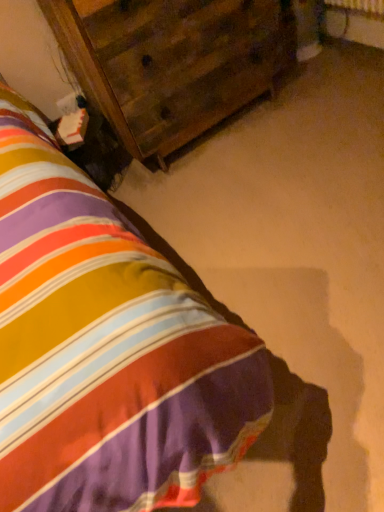
What do you see at coordinates (106, 348) in the screenshot?
I see `wooden nightstand at center` at bounding box center [106, 348].

Locate an element on the screen. wooden nightstand at center is located at coordinates (106, 348).

What is the approximate width of wooden nightstand at center?

wooden nightstand at center is 6.70 feet wide.

What do you see at coordinates (172, 62) in the screenshot? This screenshot has width=384, height=512. I see `wooden dresser at upper left` at bounding box center [172, 62].

Locate an element on the screen. This screenshot has height=512, width=384. wooden dresser at upper left is located at coordinates pos(172,62).

Where is `wooden nightstand at center`? The image size is (384, 512). wooden nightstand at center is located at coordinates (106, 348).

Looking at this image, is wooden nightstand at center to the left of wooden dresser at upper left from the viewer's perspective?

Incorrect, wooden nightstand at center is not on the left side of wooden dresser at upper left.

Looking at this image, does wooden nightstand at center lie in front of wooden dresser at upper left?

Yes, wooden nightstand at center is closer to the camera.

Considering the points (118, 482) and (73, 9), which point is behind, point (118, 482) or point (73, 9)?

The point (73, 9) is farther from the camera.

From the image's perspective, who appears lower, wooden nightstand at center or wooden dresser at upper left?

From the image's view, wooden nightstand at center is below.

From a real-world perspective, which is physically below, wooden nightstand at center or wooden dresser at upper left?

From a 3D spatial view, wooden nightstand at center is below.

Which object is wider, wooden nightstand at center or wooden dresser at upper left?

wooden nightstand at center is wider.

Which of these two, wooden nightstand at center or wooden dresser at upper left, stands shorter?

wooden nightstand at center.

Considering the relative sizes of wooden nightstand at center and wooden dresser at upper left in the image provided, is wooden nightstand at center smaller than wooden dresser at upper left?

Correct, wooden nightstand at center occupies less space than wooden dresser at upper left.

Is wooden nightstand at center surrounding wooden dresser at upper left?

No, wooden dresser at upper left is located outside of wooden nightstand at center.

Would you say wooden nightstand at center is a long distance from wooden dresser at upper left?

Indeed, wooden nightstand at center is not near wooden dresser at upper left.

Is wooden nightstand at center facing towards wooden dresser at upper left?

No, wooden nightstand at center is not aimed at wooden dresser at upper left.

Measure the distance between wooden nightstand at center and wooden dresser at upper left.

A distance of 1.01 meters exists between wooden nightstand at center and wooden dresser at upper left.

Image resolution: width=384 pixels, height=512 pixels. Find the location of `nightstand in front of the wooden dresser at upper left`. nightstand in front of the wooden dresser at upper left is located at coordinates (106, 348).

Considering the relative positions of wooden dresser at upper left and wooden nightstand at center in the image provided, is wooden dresser at upper left to the left or to the right of wooden nightstand at center?

In the image, wooden dresser at upper left appears on the left side of wooden nightstand at center.

Which object is more forward, wooden dresser at upper left or wooden nightstand at center?

wooden nightstand at center is more forward.

Between point (281, 68) and point (90, 211), which one is positioned in front?

Point (90, 211)

From the image's perspective, is wooden dresser at upper left over wooden nightstand at center?

Yes, from the image's perspective, wooden dresser at upper left is above wooden nightstand at center.

From a real-world perspective, between wooden dresser at upper left and wooden nightstand at center, who is vertically lower?

wooden nightstand at center, from a real-world perspective.

Is wooden dresser at upper left thinner than wooden nightstand at center?

Yes, wooden dresser at upper left is thinner than wooden nightstand at center.

Does wooden dresser at upper left have a greater height compared to wooden nightstand at center?

Correct, wooden dresser at upper left is much taller as wooden nightstand at center.

Does wooden dresser at upper left have a larger size compared to wooden nightstand at center?

Correct, wooden dresser at upper left is larger in size than wooden nightstand at center.

Is wooden dresser at upper left surrounding wooden nightstand at center?

No, wooden nightstand at center is located outside of wooden dresser at upper left.

Is wooden dresser at upper left positioned far away from wooden nightstand at center?

Indeed, wooden dresser at upper left is not near wooden nightstand at center.

Is wooden dresser at upper left positioned with its back to wooden nightstand at center?

wooden dresser at upper left does not have its back to wooden nightstand at center.

What's the angular difference between wooden dresser at upper left and wooden nightstand at center's facing directions?

They differ by 0.72 degrees in their facing directions.

How far apart are wooden dresser at upper left and wooden nightstand at center?

wooden dresser at upper left is 3.32 feet away from wooden nightstand at center.

The image size is (384, 512). I want to click on furniture behind the wooden nightstand at center, so click(172, 62).

Find the location of a particular element. This screenshot has height=512, width=384. nightstand lying in front of the wooden dresser at upper left is located at coordinates (106, 348).

This screenshot has width=384, height=512. I want to click on furniture that is above the wooden nightstand at center (from the image's perspective), so click(x=172, y=62).